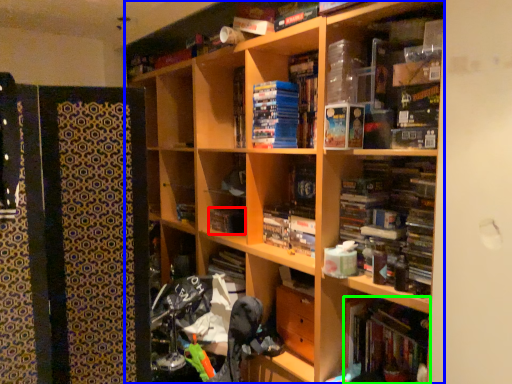
Question: Estimate the real-world distances between objects in this image. Which object is farther from book (highlighted by a red box), bookcase (highlighted by a blue box) or book (highlighted by a green box)?

Choices:
 (A) bookcase
 (B) book

Answer: (B)